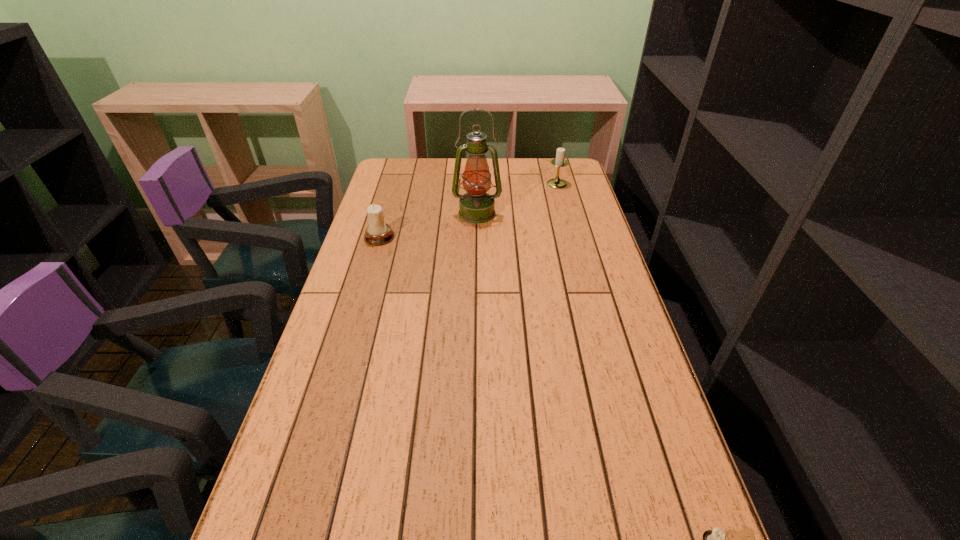
Identify the location of the tallest object. (476, 206).

The height and width of the screenshot is (540, 960). Find the location of `the third nearest object`. the third nearest object is located at coordinates (476, 206).

Find the location of a particular element. The height and width of the screenshot is (540, 960). the tallest candle holder is located at coordinates (559, 161).

At what (x,y) coordinates should I click in order to perform the action: click on the farthest object. Please return your answer as a coordinate pair (x, y). The image size is (960, 540). Looking at the image, I should click on (559, 161).

At what (x,y) coordinates should I click in order to perform the action: click on the leftmost candle holder. Please return your answer as a coordinate pair (x, y). The width and height of the screenshot is (960, 540). Looking at the image, I should click on (378, 232).

At what (x,y) coordinates should I click in order to perform the action: click on the leftmost object. Please return your answer as a coordinate pair (x, y). Looking at the image, I should click on (378, 232).

I want to click on free space located 0.080m on the right of the third nearest object, so click(524, 213).

Locate an element on the screen. Image resolution: width=960 pixels, height=540 pixels. vacant space located on the back of the second tallest object is located at coordinates (550, 160).

Image resolution: width=960 pixels, height=540 pixels. I want to click on free space located on the right of the leftmost candle holder, so click(516, 237).

This screenshot has height=540, width=960. What are the coordinates of `object that is at the far edge` in the screenshot? It's located at [559, 161].